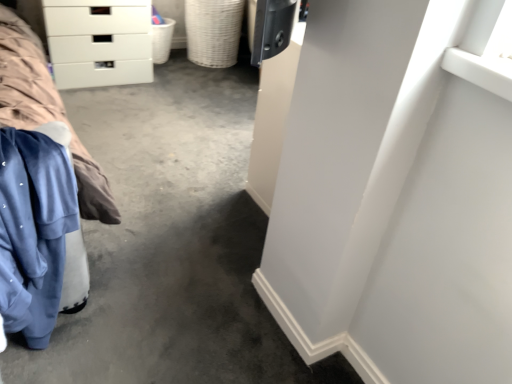
Question: Is blue fleece at left in front of or behind white plastic basket at upper left, which is the 2th basket from right to left, in the image?

Choices:
 (A) front
 (B) behind

Answer: (A)

Question: Looking at the image, does blue fleece at left seem bigger or smaller compared to white plastic basket at upper left, the 1th basket in the left-to-right sequence?

Choices:
 (A) small
 (B) big

Answer: (B)

Question: Which object is positioned closest to the blue fleece at left?

Choices:
 (A) woven beige basket at center, which is counted as the first basket, starting from the right
 (B) white glossy chest of drawers at upper left
 (C) white plastic basket at upper left, which is the 2th basket from right to left

Answer: (B)

Question: Estimate the real-world distances between objects in this image. Which object is farther from the white plastic basket at upper left, which is the 2th basket from right to left?

Choices:
 (A) white glossy chest of drawers at upper left
 (B) blue fleece at left
 (C) woven beige basket at center, the second basket viewed from the left

Answer: (B)